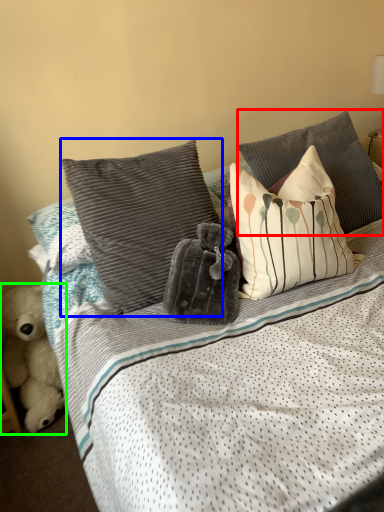
Question: Which object is positioned farthest from pillow (highlighted by a red box)? Select from pillow (highlighted by a blue box) and teddy bear (highlighted by a green box).

Choices:
 (A) pillow
 (B) teddy bear

Answer: (B)